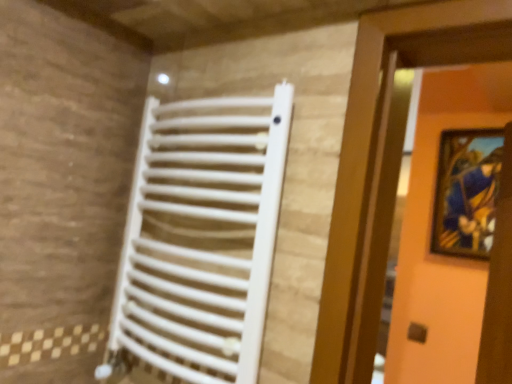
Question: Does matte wooden picture frame at upper right have a greater width compared to white matte radiator at center?

Choices:
 (A) yes
 (B) no

Answer: (B)

Question: Can you confirm if matte wooden picture frame at upper right is positioned to the right of white matte radiator at center?

Choices:
 (A) no
 (B) yes

Answer: (B)

Question: Is matte wooden picture frame at upper right next to white matte radiator at center and touching it?

Choices:
 (A) yes
 (B) no

Answer: (B)

Question: Considering the relative sizes of matte wooden picture frame at upper right and white matte radiator at center in the image provided, is matte wooden picture frame at upper right taller than white matte radiator at center?

Choices:
 (A) yes
 (B) no

Answer: (B)

Question: Is matte wooden picture frame at upper right thinner than white matte radiator at center?

Choices:
 (A) no
 (B) yes

Answer: (B)

Question: Does matte wooden picture frame at upper right have a lesser height compared to white matte radiator at center?

Choices:
 (A) yes
 (B) no

Answer: (A)

Question: Is white matte radiator at center far away from matte wooden picture frame at upper right?

Choices:
 (A) yes
 (B) no

Answer: (A)

Question: From the image's perspective, is white matte radiator at center below matte wooden picture frame at upper right?

Choices:
 (A) no
 (B) yes

Answer: (B)

Question: From a real-world perspective, is white matte radiator at center physically below matte wooden picture frame at upper right?

Choices:
 (A) yes
 (B) no

Answer: (A)

Question: Is white matte radiator at center turned away from matte wooden picture frame at upper right?

Choices:
 (A) yes
 (B) no

Answer: (A)

Question: Considering the relative sizes of white matte radiator at center and matte wooden picture frame at upper right in the image provided, is white matte radiator at center wider than matte wooden picture frame at upper right?

Choices:
 (A) no
 (B) yes

Answer: (B)

Question: Is white matte radiator at center positioned beyond the bounds of matte wooden picture frame at upper right?

Choices:
 (A) yes
 (B) no

Answer: (A)

Question: Does point (465, 144) appear closer or farther from the camera than point (259, 129)?

Choices:
 (A) closer
 (B) farther

Answer: (B)